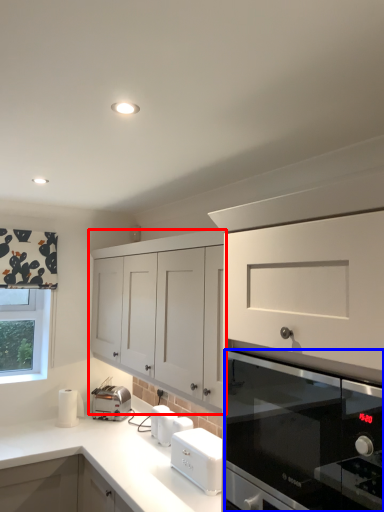
Question: Which object appears closest to the camera in this image, cabinetry (highlighted by a red box) or home appliance (highlighted by a blue box)?

Choices:
 (A) cabinetry
 (B) home appliance

Answer: (B)